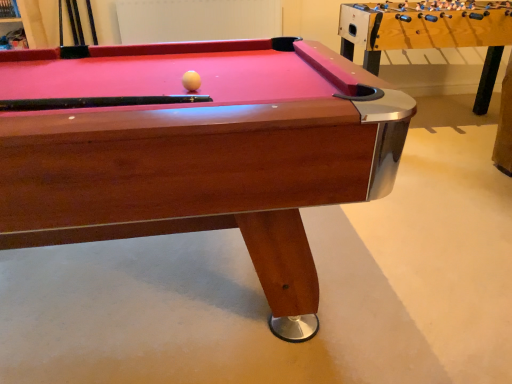
Question: Can you confirm if wooden foosball table at right is smaller than white matte ball at center?

Choices:
 (A) no
 (B) yes

Answer: (A)

Question: Is wooden foosball table at right far away from white matte ball at center?

Choices:
 (A) yes
 (B) no

Answer: (A)

Question: Is wooden foosball table at right in front of white matte ball at center?

Choices:
 (A) no
 (B) yes

Answer: (A)

Question: Is wooden foosball table at right located outside white matte ball at center?

Choices:
 (A) yes
 (B) no

Answer: (A)

Question: Considering the relative sizes of wooden foosball table at right and white matte ball at center in the image provided, is wooden foosball table at right thinner than white matte ball at center?

Choices:
 (A) no
 (B) yes

Answer: (A)

Question: Is white matte ball at center wider or thinner than wooden foosball table at right?

Choices:
 (A) thin
 (B) wide

Answer: (A)

Question: Considering the positions of white matte ball at center and wooden foosball table at right in the image, is white matte ball at center taller or shorter than wooden foosball table at right?

Choices:
 (A) tall
 (B) short

Answer: (B)

Question: Is point (188, 82) positioned closer to the camera than point (421, 39)?

Choices:
 (A) closer
 (B) farther

Answer: (A)

Question: From the image's perspective, is white matte ball at center positioned above or below wooden foosball table at right?

Choices:
 (A) below
 (B) above

Answer: (A)

Question: Is wooden foosball table at right situated inside white matte ball at center or outside?

Choices:
 (A) outside
 (B) inside

Answer: (A)

Question: Considering the positions of point (496, 61) and point (184, 82), is point (496, 61) closer or farther from the camera than point (184, 82)?

Choices:
 (A) farther
 (B) closer

Answer: (A)

Question: From a real-world perspective, is wooden foosball table at right above or below white matte ball at center?

Choices:
 (A) below
 (B) above

Answer: (A)

Question: Based on their positions, is wooden foosball table at right located to the left or right of white matte ball at center?

Choices:
 (A) left
 (B) right

Answer: (B)

Question: Is wooden billiard table at center bigger or smaller than wooden foosball table at right?

Choices:
 (A) big
 (B) small

Answer: (B)

Question: From the image's perspective, relative to wooden foosball table at right, is wooden billiard table at center above or below?

Choices:
 (A) above
 (B) below

Answer: (B)